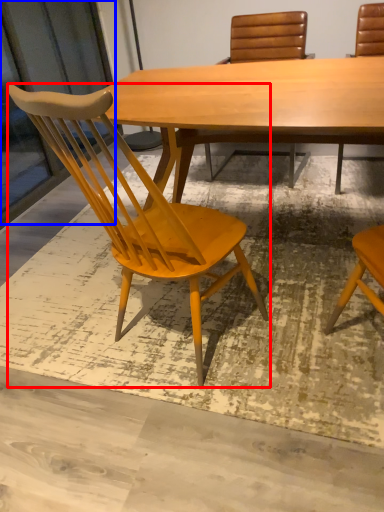
Question: Which object appears closest to the camera in this image, chair (highlighted by a red box) or screen door (highlighted by a blue box)?

Choices:
 (A) chair
 (B) screen door

Answer: (A)